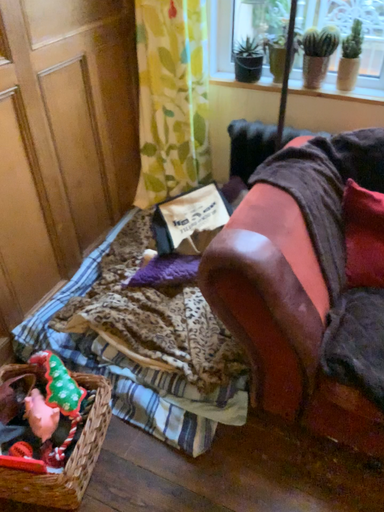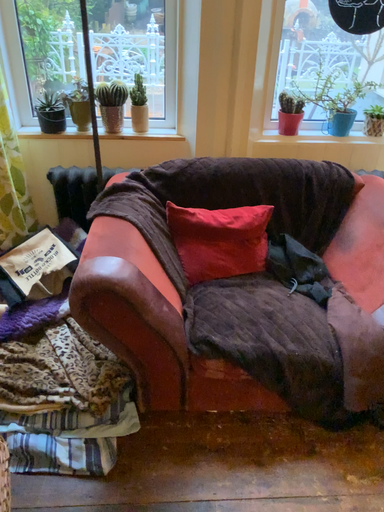
Question: How did the camera likely rotate when shooting the video?

Choices:
 (A) rotated left
 (B) rotated right

Answer: (B)